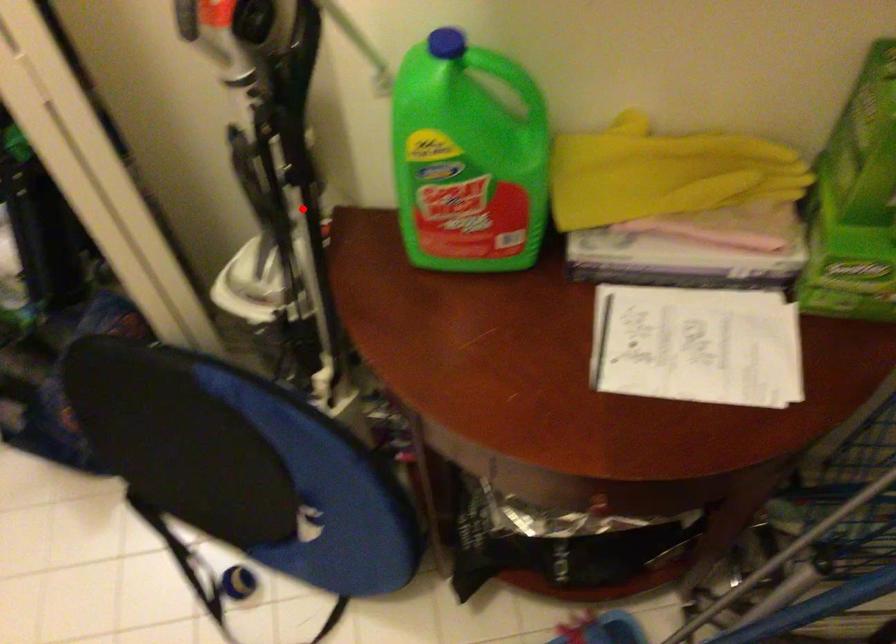
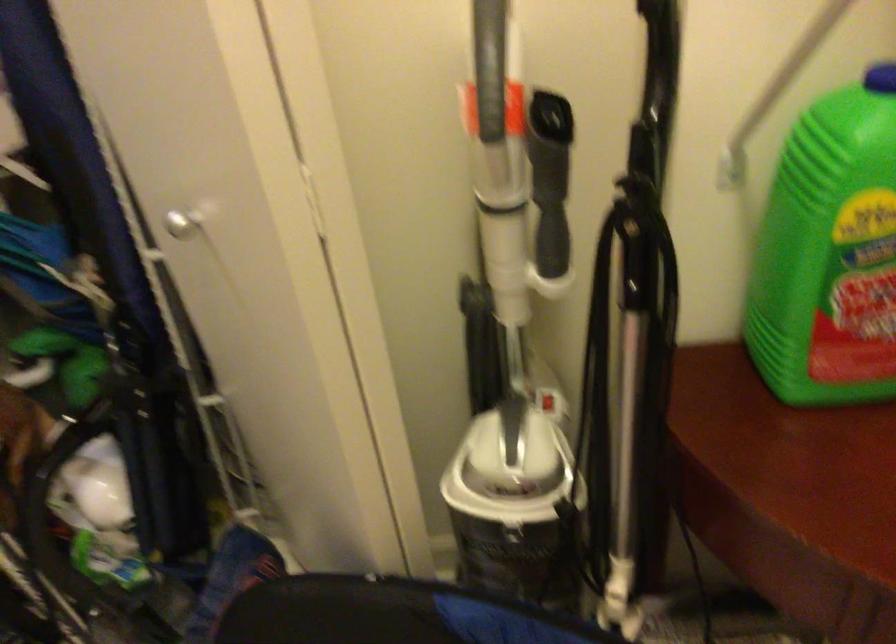
Question: A red point is marked in image1. In image2, is the corresponding 3D point closer to the camera or farther? Reply with the corresponding letter.

Choices:
 (A) The corresponding 3D point is closer.
 (B) The corresponding 3D point is farther.

Answer: (A)